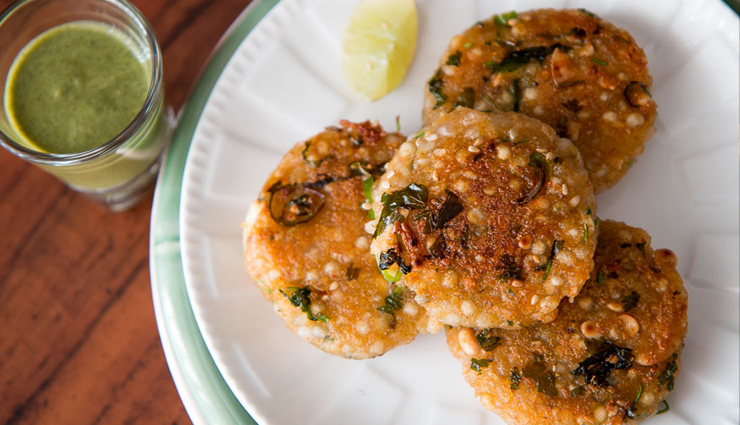
At what (x,y) coordinates should I click in order to perform the action: click on table. Please return your answer as a coordinate pair (x, y). This screenshot has height=425, width=740. Looking at the image, I should click on click(127, 355), click(81, 317), click(32, 251), click(181, 51).